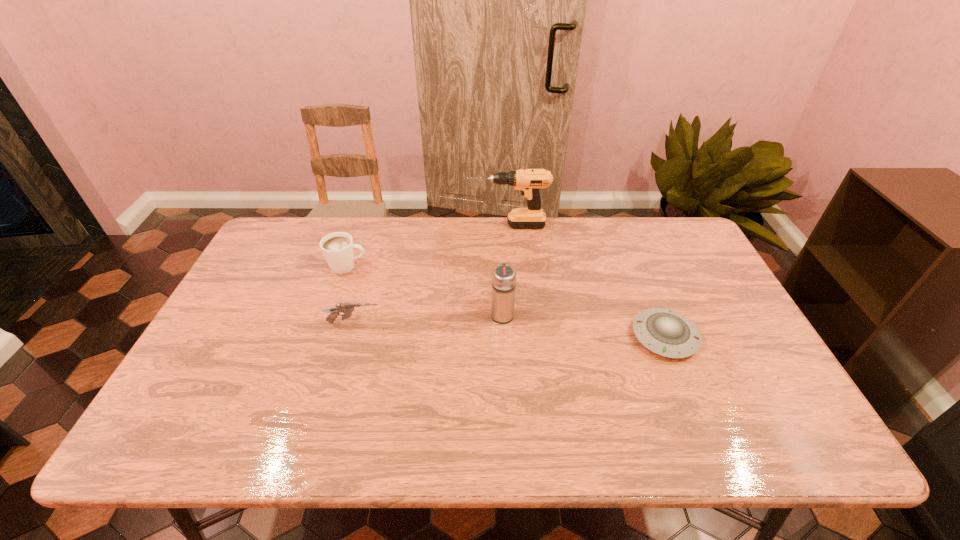
Find the location of a particular element. This screenshot has width=960, height=540. blank region between the fourth tallest object and the second farthest object is located at coordinates (350, 294).

The height and width of the screenshot is (540, 960). Find the location of `vacant space that is in between the gun and the tallest object`. vacant space that is in between the gun and the tallest object is located at coordinates (431, 274).

Locate an element on the screen. vacant area that lies between the second shortest object and the rightmost object is located at coordinates (509, 330).

The image size is (960, 540). In order to click on unoccupied position between the third shortest object and the second tallest object in this screenshot , I will do `click(425, 290)`.

Identify which object is located as the third nearest to the second shortest object. Please provide its 2D coordinates. Your answer should be formatted as a tuple, i.e. [(x, y)], where the tuple contains the x and y coordinates of a point satisfying the conditions above.

[(529, 181)]

Locate which object is the fourth closest to the farthest object. Please provide its 2D coordinates. Your answer should be formatted as a tuple, i.e. [(x, y)], where the tuple contains the x and y coordinates of a point satisfying the conditions above.

[(347, 308)]

Locate an element on the screen. free space in the image that satisfies the following two spatial constraints: 1. with a handle on the side of the fourth shortest object; 2. with the handle on the side of the third shortest object is located at coordinates (500, 266).

Image resolution: width=960 pixels, height=540 pixels. I want to click on blank area in the image that satisfies the following two spatial constraints: 1. with the handle on the side of the third tallest object; 2. with a handle on the side of the second tallest object, so click(x=331, y=314).

You are a GUI agent. You are given a task and a screenshot of the screen. Output one action in this format:
    pyautogui.click(x=<x>, y=<y>)
    Task: Click on the vacant space that satisfies the following two spatial constraints: 1. at the barrel of the shortest object; 2. on the left side of the second shortest object
    The image size is (960, 540).
    Given the screenshot: What is the action you would take?
    pyautogui.click(x=349, y=337)

At what (x,y) coordinates should I click in order to perform the action: click on vacant space that satisfies the following two spatial constraints: 1. at the barrel of the saucer; 2. on the right side of the gun. Please return your answer as a coordinate pair (x, y). Image resolution: width=960 pixels, height=540 pixels. Looking at the image, I should click on (349, 337).